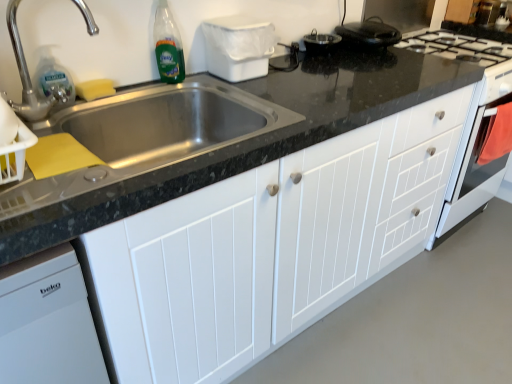
Question: Is silver metallic faucet at upper left located outside white wood cabinet at center?

Choices:
 (A) no
 (B) yes

Answer: (B)

Question: Can you confirm if silver metallic faucet at upper left is smaller than white wood cabinet at center?

Choices:
 (A) yes
 (B) no

Answer: (A)

Question: From the image's perspective, is silver metallic faucet at upper left located above white wood cabinet at center?

Choices:
 (A) yes
 (B) no

Answer: (A)

Question: Considering the relative sizes of silver metallic faucet at upper left and white wood cabinet at center in the image provided, is silver metallic faucet at upper left thinner than white wood cabinet at center?

Choices:
 (A) no
 (B) yes

Answer: (B)

Question: Is there a large distance between silver metallic faucet at upper left and white wood cabinet at center?

Choices:
 (A) no
 (B) yes

Answer: (A)

Question: Is silver metallic faucet at upper left in front of or behind green glass bottle at upper left in the image?

Choices:
 (A) front
 (B) behind

Answer: (A)

Question: Would you say silver metallic faucet at upper left is to the left or to the right of green glass bottle at upper left in the picture?

Choices:
 (A) left
 (B) right

Answer: (A)

Question: From a real-world perspective, relative to green glass bottle at upper left, is silver metallic faucet at upper left vertically above or below?

Choices:
 (A) above
 (B) below

Answer: (A)

Question: Is silver metallic faucet at upper left wider or thinner than green glass bottle at upper left?

Choices:
 (A) thin
 (B) wide

Answer: (B)

Question: From a real-world perspective, relative to silver metallic faucet at upper left, is green glass bottle at upper left vertically above or below?

Choices:
 (A) below
 (B) above

Answer: (A)

Question: Considering their positions, is green glass bottle at upper left located in front of or behind silver metallic faucet at upper left?

Choices:
 (A) front
 (B) behind

Answer: (B)

Question: In terms of size, does green glass bottle at upper left appear bigger or smaller than silver metallic faucet at upper left?

Choices:
 (A) big
 (B) small

Answer: (B)

Question: From their relative heights in the image, would you say green glass bottle at upper left is taller or shorter than silver metallic faucet at upper left?

Choices:
 (A) short
 (B) tall

Answer: (A)

Question: From a real-world perspective, is silver metallic faucet at upper left above or below white wood cabinet at center?

Choices:
 (A) below
 (B) above

Answer: (B)

Question: In terms of height, does silver metallic faucet at upper left look taller or shorter compared to white wood cabinet at center?

Choices:
 (A) tall
 (B) short

Answer: (B)